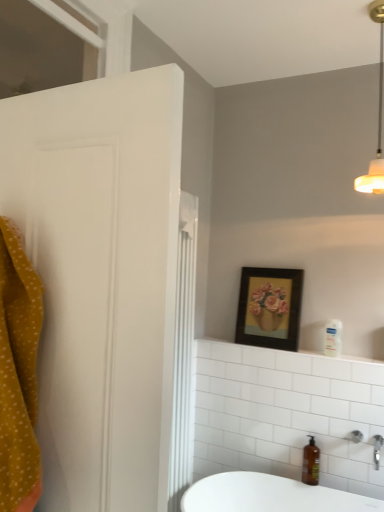
The height and width of the screenshot is (512, 384). What are the coordinates of `free area in between wooden framed picture at upper center and clear plastic pump bottle at upper right` in the screenshot? It's located at (309, 351).